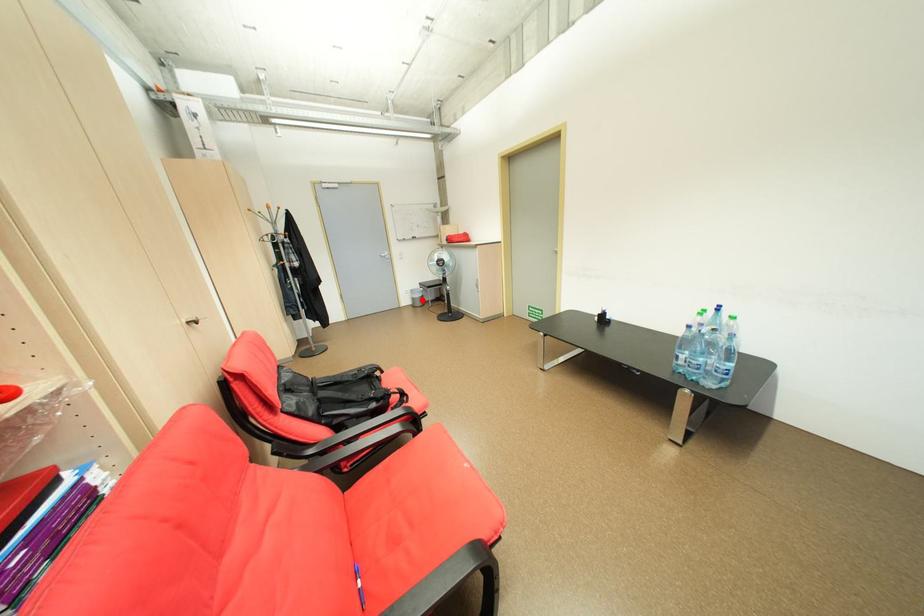
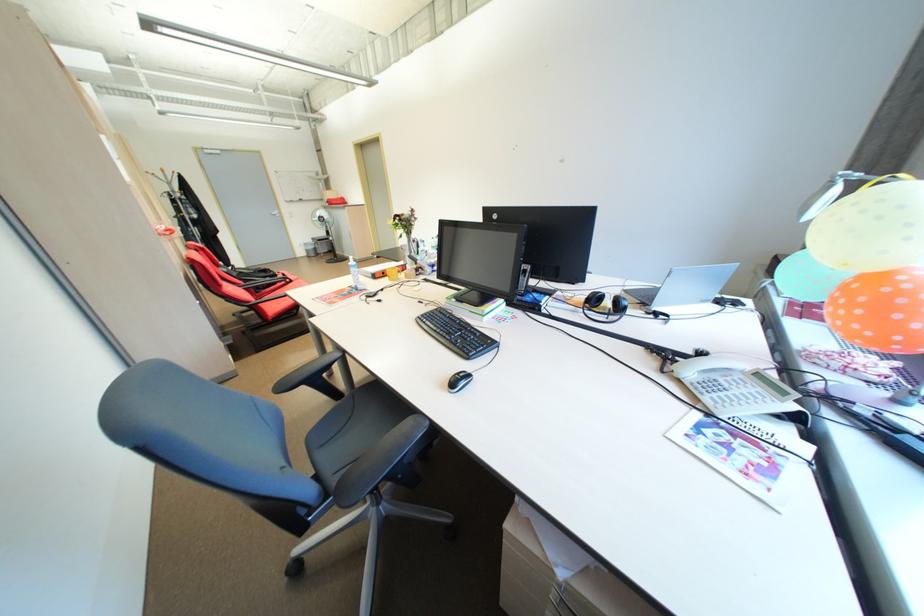
Find the pixel in the second image that matches the highlighted location in the first image.

(315, 252)